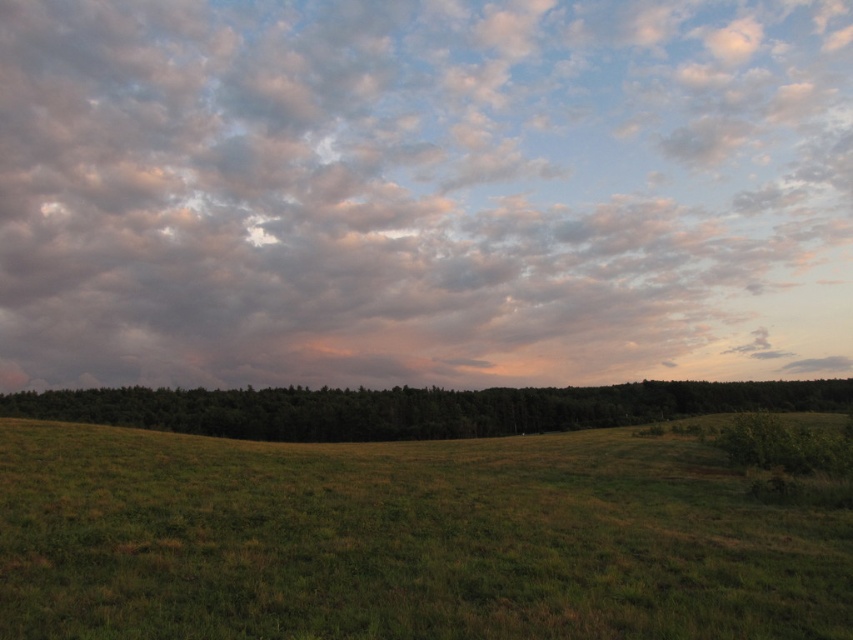
You are standing in the open grassland and looking towards the horizon. Which object, the cloudy sky at upper center or the green leafy forest at center, is positioned to the left when facing the horizon?

The cloudy sky at upper center is positioned to the left of the green leafy forest at center.